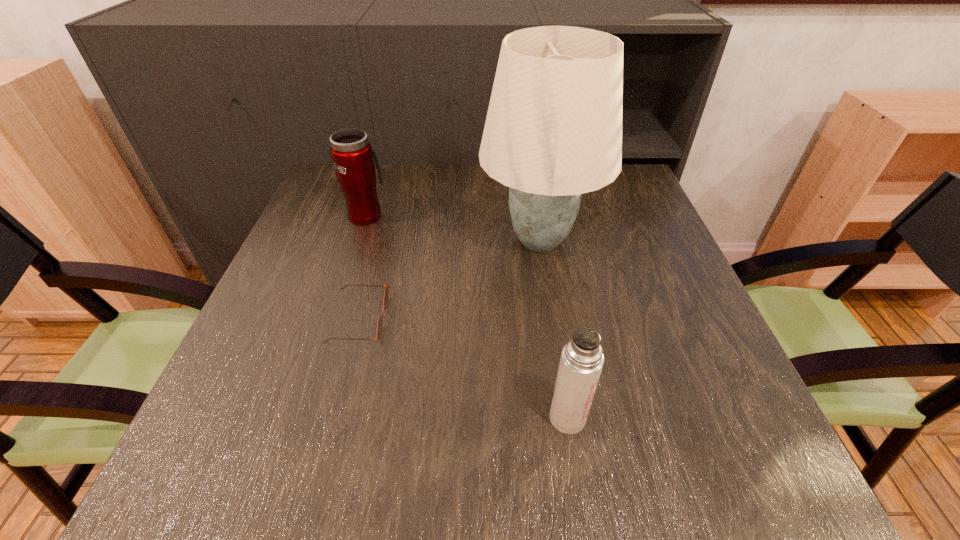
You are a GUI agent. You are given a task and a screenshot of the screen. Output one action in this format:
    pyautogui.click(x=<x>, y=<y>)
    Task: Click on the free region located on the front of the right thermos bottle
    Image resolution: width=960 pixels, height=540 pixels.
    Given the screenshot: What is the action you would take?
    pyautogui.click(x=577, y=481)

Where is `vacant region located 0.160m on the face of the shortest object`? The height and width of the screenshot is (540, 960). vacant region located 0.160m on the face of the shortest object is located at coordinates (467, 319).

At what (x,y) coordinates should I click in order to perform the action: click on lampshade located at the far edge. Please return your answer as a coordinate pair (x, y). Looking at the image, I should click on (553, 131).

Image resolution: width=960 pixels, height=540 pixels. I want to click on thermos bottle located at the far edge, so click(x=352, y=154).

Locate an element on the screen. The image size is (960, 540). thermos bottle positioned at the left edge is located at coordinates (352, 154).

Locate an element on the screen. The height and width of the screenshot is (540, 960). sunglasses present at the left edge is located at coordinates tap(386, 294).

Identify the location of object present at the right edge. (553, 131).

The width and height of the screenshot is (960, 540). I want to click on object at the far left corner, so click(352, 154).

Identify the location of object situated at the far right corner. (553, 131).

Find the location of a particular element. Image resolution: width=960 pixels, height=540 pixels. free space at the far edge of the desktop is located at coordinates (410, 176).